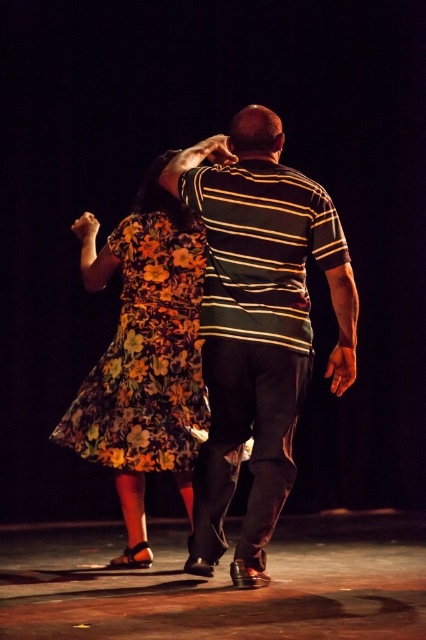
Can you confirm if striped cotton shirt at center is positioned above floral-patterned fabric dress at center?

No.

Locate an element on the screen. striped cotton shirt at center is located at coordinates (258, 324).

Does point (259, 330) come behind point (103, 376)?

No, it is not.

At what (x,y) coordinates should I click in order to perform the action: click on striped cotton shirt at center. Please return your answer as a coordinate pair (x, y). This screenshot has width=426, height=640. Looking at the image, I should click on (258, 324).